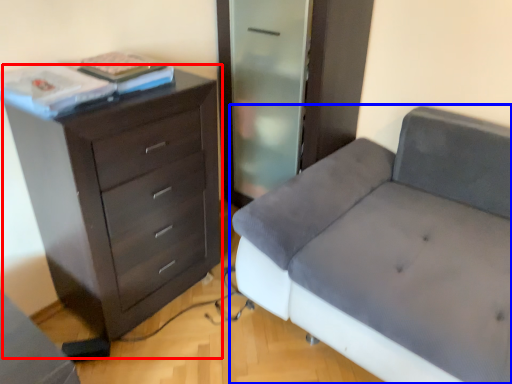
Question: Which object is further to the camera taking this photo, chest of drawers (highlighted by a red box) or studio couch (highlighted by a blue box)?

Choices:
 (A) chest of drawers
 (B) studio couch

Answer: (A)